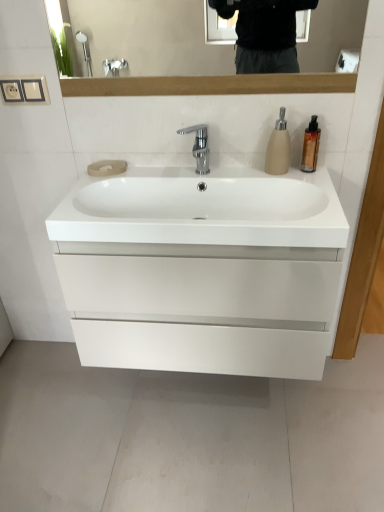
Question: From a real-world perspective, is gold metallic soap dispenser at upper right, which appears as the 2th soap dispenser when viewed from the left, below white glossy sink at center?

Choices:
 (A) yes
 (B) no

Answer: (B)

Question: Is gold metallic soap dispenser at upper right, which appears as the 2th soap dispenser when viewed from the left, positioned far away from white glossy sink at center?

Choices:
 (A) yes
 (B) no

Answer: (B)

Question: Is gold metallic soap dispenser at upper right, which appears as the 2th soap dispenser when viewed from the left, looking in the opposite direction of white glossy sink at center?

Choices:
 (A) yes
 (B) no

Answer: (B)

Question: Is gold metallic soap dispenser at upper right, which is the first soap dispenser from right to left, positioned in front of white glossy sink at center?

Choices:
 (A) no
 (B) yes

Answer: (A)

Question: Can you confirm if gold metallic soap dispenser at upper right, which is the first soap dispenser from right to left, is positioned to the right of white glossy sink at center?

Choices:
 (A) yes
 (B) no

Answer: (A)

Question: Is gold metallic soap dispenser at upper right, which appears as the 2th soap dispenser when viewed from the left, beside white glossy sink at center?

Choices:
 (A) no
 (B) yes

Answer: (A)

Question: Can you confirm if white glossy sink at center is positioned to the left of polished chrome faucet at center?

Choices:
 (A) no
 (B) yes

Answer: (A)

Question: Is white glossy sink at center taller than polished chrome faucet at center?

Choices:
 (A) no
 (B) yes

Answer: (A)

Question: Does white glossy sink at center have a lesser width compared to polished chrome faucet at center?

Choices:
 (A) yes
 (B) no

Answer: (B)

Question: Considering the relative sizes of white glossy sink at center and polished chrome faucet at center in the image provided, is white glossy sink at center wider than polished chrome faucet at center?

Choices:
 (A) yes
 (B) no

Answer: (A)

Question: Is white glossy sink at center located outside polished chrome faucet at center?

Choices:
 (A) yes
 (B) no

Answer: (A)

Question: Can you confirm if white glossy sink at center is positioned to the right of polished chrome faucet at center?

Choices:
 (A) yes
 (B) no

Answer: (A)

Question: Could you tell me if gold metallic soap dispenser at upper right, which is the first soap dispenser from right to left, is turned towards polished chrome faucet at center?

Choices:
 (A) yes
 (B) no

Answer: (B)